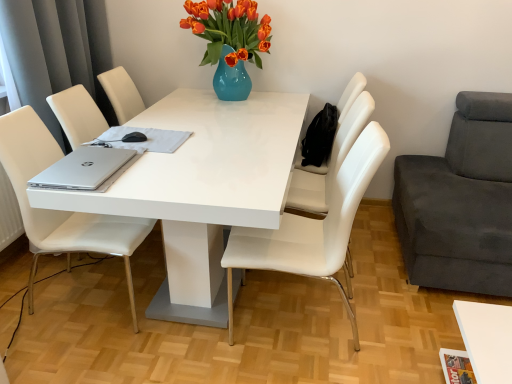
Locate an element on the screen. The width and height of the screenshot is (512, 384). empty space that is in between silver metallic laptop at left and white cloth at center is located at coordinates (139, 165).